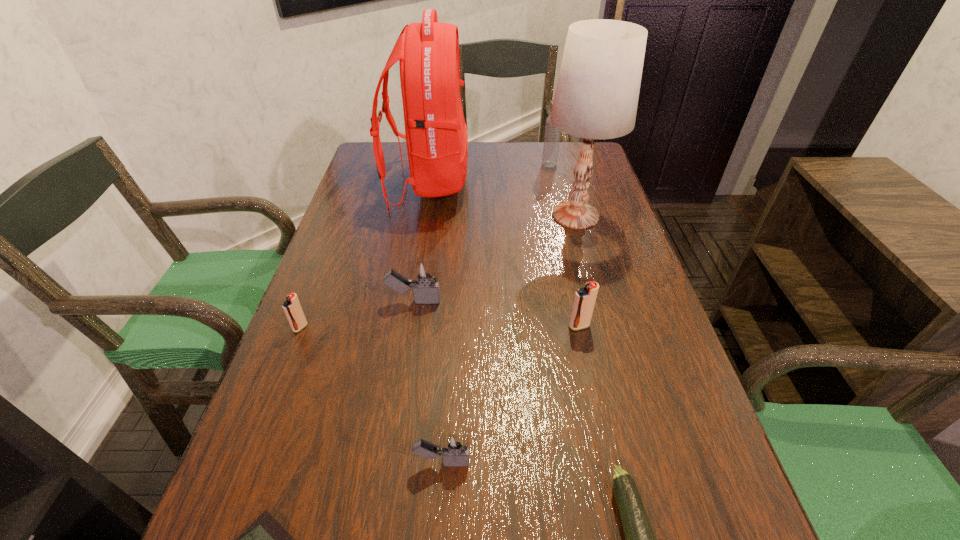
The height and width of the screenshot is (540, 960). Identify the location of vacant space at the right edge. (604, 249).

Image resolution: width=960 pixels, height=540 pixels. I want to click on free space at the far left corner of the desktop, so click(405, 156).

Locate an element on the screen. This screenshot has height=540, width=960. empty space that is in between the seventh shortest object and the left red igniter is located at coordinates (424, 246).

Image resolution: width=960 pixels, height=540 pixels. What are the coordinates of `vacant space that is in between the third tallest object and the red backpack` in the screenshot? It's located at (489, 174).

The width and height of the screenshot is (960, 540). In order to click on free space between the lamp and the backpack in this screenshot , I will do `click(502, 200)`.

The height and width of the screenshot is (540, 960). Find the location of `free space that is in between the water bottle and the right red igniter`. free space that is in between the water bottle and the right red igniter is located at coordinates (564, 245).

Find the location of a particular element. The height and width of the screenshot is (540, 960). vacant area that lies between the nearest igniter and the rightmost igniter is located at coordinates (511, 394).

Find the location of a particular element. unoccupied position between the third tallest object and the lamp is located at coordinates (563, 190).

Identify the location of free space between the farther gray igniter and the blue water bottle. This screenshot has height=540, width=960. (482, 233).

The height and width of the screenshot is (540, 960). I want to click on object that is the fifth closest to the green zucchini, so click(x=597, y=92).